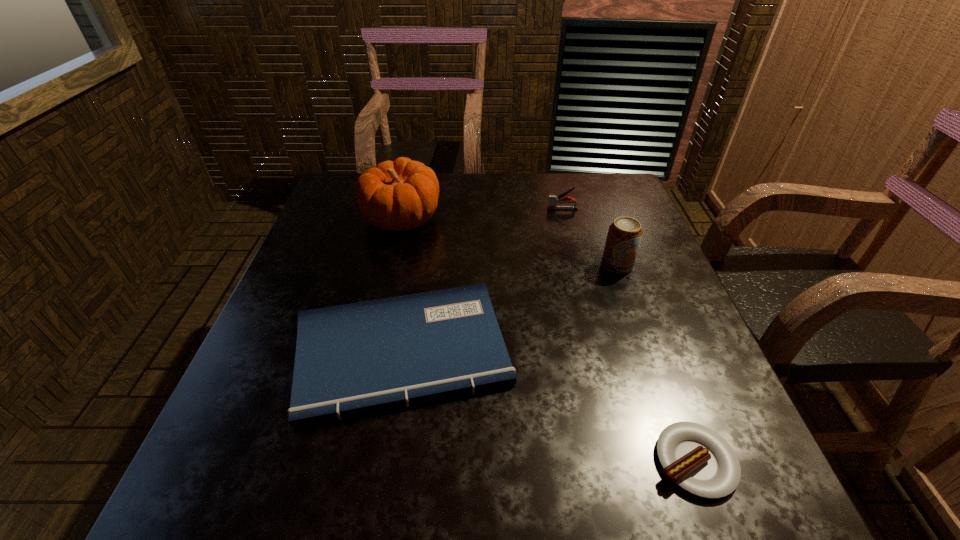
Find the location of a particular element. the tallest object is located at coordinates (400, 195).

Locate an element on the screen. The image size is (960, 540). beer can is located at coordinates (624, 235).

Find the location of a particular element. This screenshot has width=960, height=540. the third farthest object is located at coordinates (624, 235).

You are a GUI agent. You are given a task and a screenshot of the screen. Output one action in this format:
    pyautogui.click(x=<x>, y=<y>)
    Task: Click on the third object from left to right
    The height and width of the screenshot is (540, 960).
    Given the screenshot: What is the action you would take?
    click(553, 200)

Locate an element on the screen. This screenshot has width=960, height=540. the third tallest object is located at coordinates (553, 200).

This screenshot has height=540, width=960. In order to click on paperback book in this screenshot , I will do tap(356, 358).

Locate an element on the screen. The height and width of the screenshot is (540, 960). sausage is located at coordinates (696, 458).

At what (x,y) coordinates should I click in order to perform the action: click on free space located 0.120m on the right of the pumpkin. Please return your answer as a coordinate pair (x, y). This screenshot has width=960, height=540. Looking at the image, I should click on (484, 219).

Find the location of `vacant position located 0.320m on the front of the beer can`. vacant position located 0.320m on the front of the beer can is located at coordinates (660, 391).

Locate an element on the screen. Image resolution: width=960 pixels, height=540 pixels. blank area located 0.070m on the handle side of the third object from left to right is located at coordinates (523, 209).